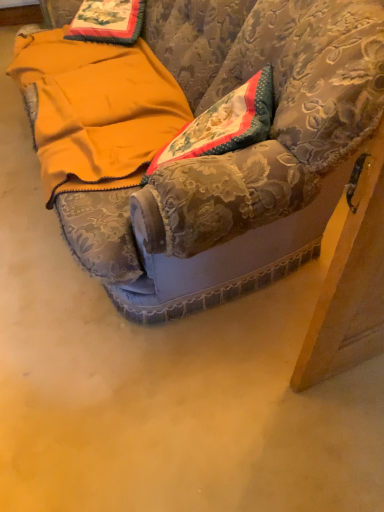
Question: Should I look upward or downward to see velvet couch at center?

Choices:
 (A) down
 (B) up

Answer: (B)

Question: Is velvet couch at center to the right of yellow fleece blanket at lower left from the viewer's perspective?

Choices:
 (A) no
 (B) yes

Answer: (B)

Question: Is velvet couch at center touching yellow fleece blanket at lower left?

Choices:
 (A) yes
 (B) no

Answer: (B)

Question: Is velvet couch at center thinner than yellow fleece blanket at lower left?

Choices:
 (A) yes
 (B) no

Answer: (B)

Question: Is velvet couch at center located outside yellow fleece blanket at lower left?

Choices:
 (A) no
 (B) yes

Answer: (B)

Question: From the image's perspective, is velvet couch at center below yellow fleece blanket at lower left?

Choices:
 (A) yes
 (B) no

Answer: (B)

Question: Is velvet couch at center positioned far away from yellow fleece blanket at lower left?

Choices:
 (A) yes
 (B) no

Answer: (B)

Question: Considering the relative sizes of yellow fleece blanket at lower left and velvet couch at center in the image provided, is yellow fleece blanket at lower left thinner than velvet couch at center?

Choices:
 (A) yes
 (B) no

Answer: (A)

Question: Would you say yellow fleece blanket at lower left is a long distance from velvet couch at center?

Choices:
 (A) yes
 (B) no

Answer: (B)

Question: Is yellow fleece blanket at lower left bigger than velvet couch at center?

Choices:
 (A) no
 (B) yes

Answer: (A)

Question: Considering the relative sizes of yellow fleece blanket at lower left and velvet couch at center in the image provided, is yellow fleece blanket at lower left taller than velvet couch at center?

Choices:
 (A) no
 (B) yes

Answer: (A)

Question: Is yellow fleece blanket at lower left at the left side of velvet couch at center?

Choices:
 (A) yes
 (B) no

Answer: (A)

Question: Is yellow fleece blanket at lower left positioned with its back to velvet couch at center?

Choices:
 (A) yes
 (B) no

Answer: (A)

Question: From the image's perspective, is yellow fleece blanket at lower left located above or below velvet couch at center?

Choices:
 (A) below
 (B) above

Answer: (A)